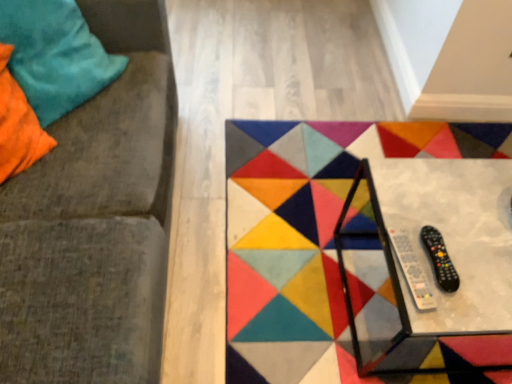
Question: From a real-world perspective, is velvety teal pillow at upper left physically located above or below black plastic remote at lower right?

Choices:
 (A) below
 (B) above

Answer: (B)

Question: From the image's perspective, is velvety teal pillow at upper left positioned above or below black plastic remote at lower right?

Choices:
 (A) above
 (B) below

Answer: (A)

Question: Which is nearer to the black plastic remote control at lower right?

Choices:
 (A) metallic glass table at center
 (B) velvet cushion at left
 (C) black plastic remote at lower right
 (D) velvety teal pillow at upper left

Answer: (C)

Question: Which object is the farthest from the black plastic remote at lower right?

Choices:
 (A) black plastic remote control at lower right
 (B) velvety teal pillow at upper left
 (C) metallic glass table at center
 (D) velvet cushion at left

Answer: (B)